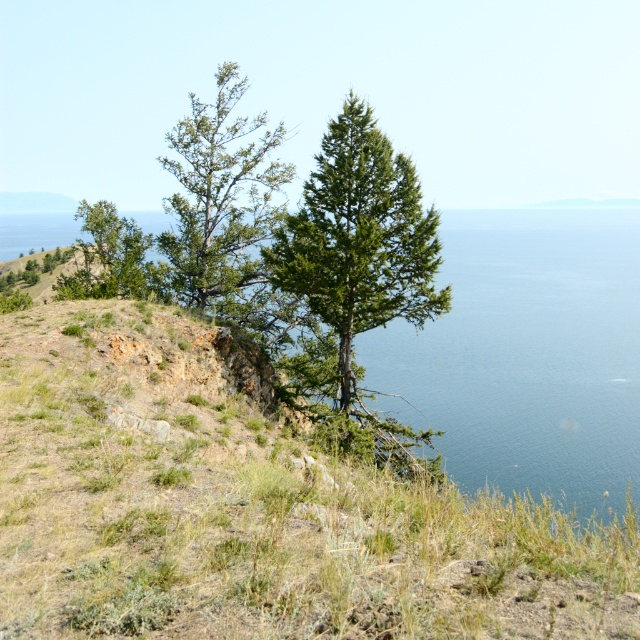
Question: Is green textured tree at upper left below green matte tree at upper left?

Choices:
 (A) no
 (B) yes

Answer: (A)

Question: Which of the following is the closest to the observer?

Choices:
 (A) green textured tree at center
 (B) green matte tree at upper left
 (C) green textured tree at upper left

Answer: (A)

Question: Which of the following is the farthest from the observer?

Choices:
 (A) (321, 292)
 (B) (268, 189)
 (C) (120, 234)

Answer: (B)

Question: Which point is closer to the camera?

Choices:
 (A) (125, 284)
 (B) (189, 204)
 (C) (385, 312)

Answer: (C)

Question: Does green textured tree at center have a greater width compared to green textured tree at upper left?

Choices:
 (A) no
 (B) yes

Answer: (A)

Question: Is green textured tree at center bigger than green textured tree at upper left?

Choices:
 (A) no
 (B) yes

Answer: (A)